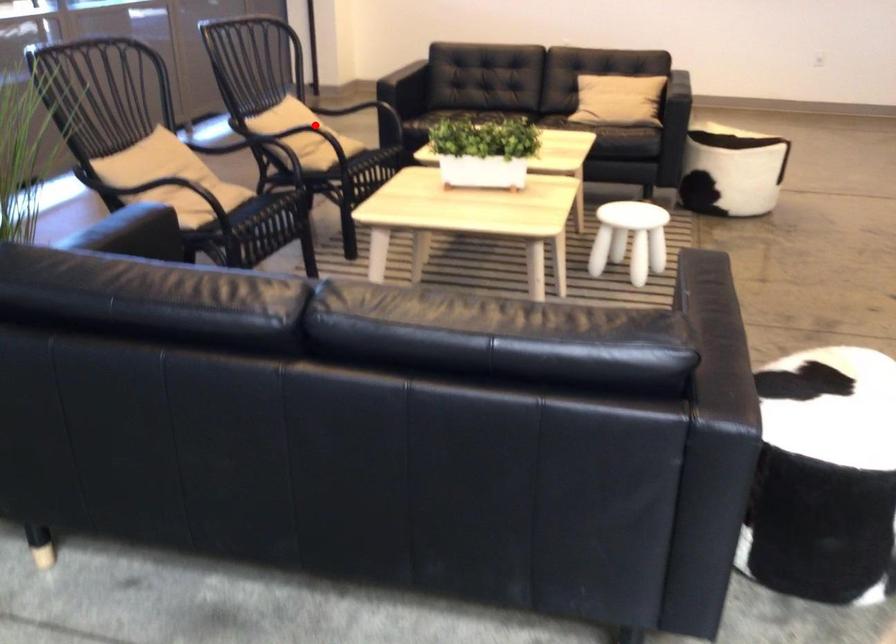
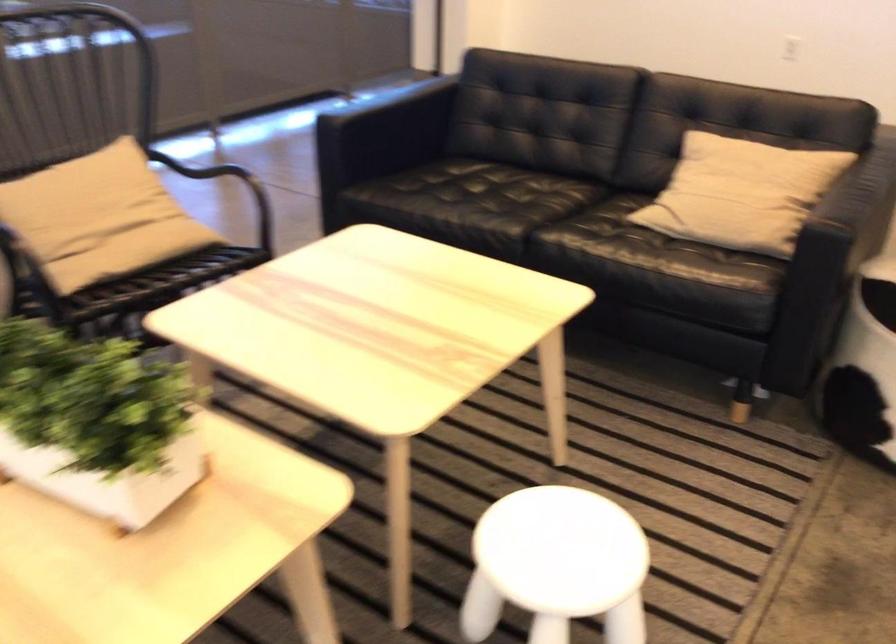
Find the pixel in the second image that matches the highlighted location in the first image.

(99, 214)